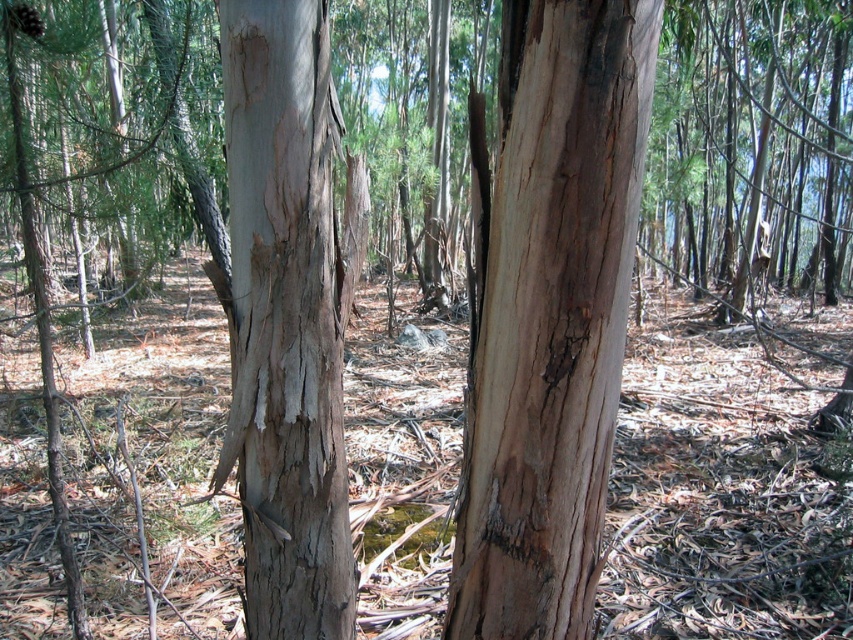
You are standing in the forest looking at two points marked on the image. The first point is at coordinates point (612, 442) and the second is at point (283, 490). Which point is closer to your eyes?

Point (612, 442) is closer to the camera than point (283, 490), so the first point is closer to your eyes.

You are a botanist studying tree bark textures. You are standing at the origin point of the image, which is the bottom left corner. Where is the light brown bark at center located in terms of coordinates?

The light brown bark at center is located at coordinates point [550,314].